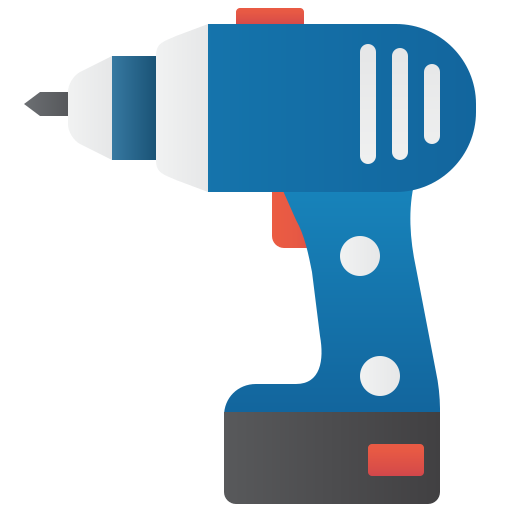
Find the location of a particular element. The image size is (512, 512). handle is located at coordinates (358, 304).